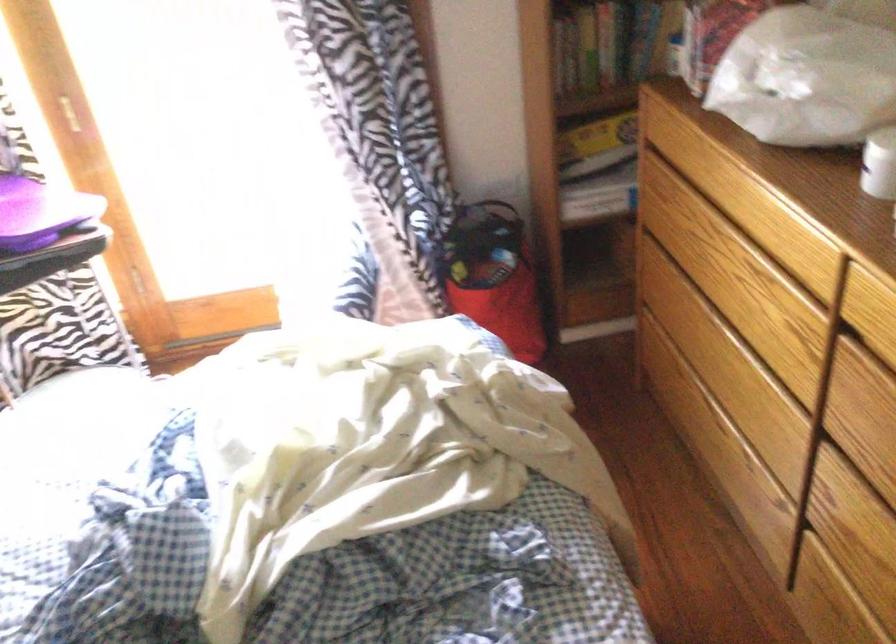
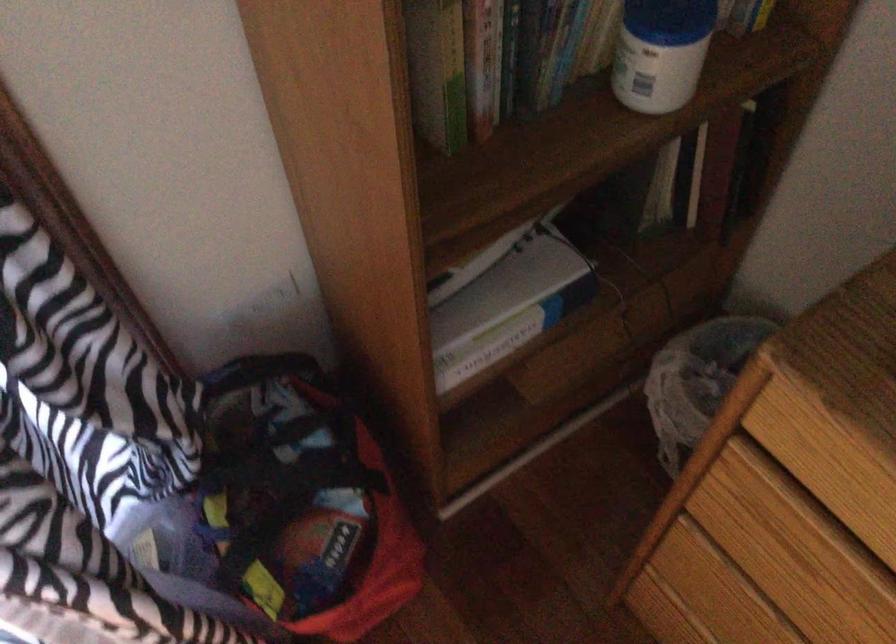
Where in the second image is the point corresponding to the point at 485,240 from the first image?

(300, 502)